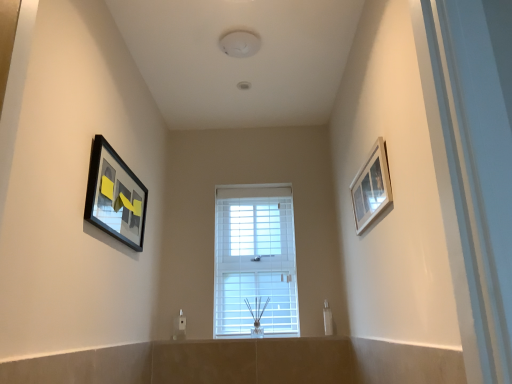
Question: From a real-world perspective, is white glossy picture frame at upper right, marked as the 1th picture frame in a right-to-left arrangement, beneath matte black picture frame at left, the second picture frame from the right?

Choices:
 (A) no
 (B) yes

Answer: (B)

Question: Can you confirm if white glossy picture frame at upper right, marked as the 1th picture frame in a right-to-left arrangement, is positioned to the right of matte black picture frame at left, the second picture frame from the right?

Choices:
 (A) yes
 (B) no

Answer: (A)

Question: Can you confirm if white glossy picture frame at upper right, marked as the 1th picture frame in a right-to-left arrangement, is smaller than matte black picture frame at left, the 1th picture frame viewed from the left?

Choices:
 (A) yes
 (B) no

Answer: (A)

Question: Can you confirm if white glossy picture frame at upper right, marked as the 1th picture frame in a right-to-left arrangement, is wider than matte black picture frame at left, the 1th picture frame viewed from the left?

Choices:
 (A) no
 (B) yes

Answer: (A)

Question: Is the surface of white glossy picture frame at upper right, the second picture frame when ordered from left to right, in direct contact with matte black picture frame at left, the second picture frame from the right?

Choices:
 (A) yes
 (B) no

Answer: (B)

Question: Is matte black picture frame at left, the 1th picture frame viewed from the left, situated inside white glossy picture frame at upper right, marked as the 1th picture frame in a right-to-left arrangement, or outside?

Choices:
 (A) outside
 (B) inside

Answer: (A)

Question: From their relative heights in the image, would you say matte black picture frame at left, the second picture frame from the right, is taller or shorter than white glossy picture frame at upper right, marked as the 1th picture frame in a right-to-left arrangement?

Choices:
 (A) short
 (B) tall

Answer: (B)

Question: Based on their positions, is matte black picture frame at left, the 1th picture frame viewed from the left, located to the left or right of white glossy picture frame at upper right, marked as the 1th picture frame in a right-to-left arrangement?

Choices:
 (A) right
 (B) left

Answer: (B)

Question: Does point (103, 158) appear closer or farther from the camera than point (391, 193)?

Choices:
 (A) closer
 (B) farther

Answer: (B)

Question: Is white matte window at center taller or shorter than white glossy picture frame at upper right, marked as the 1th picture frame in a right-to-left arrangement?

Choices:
 (A) short
 (B) tall

Answer: (B)

Question: From a real-world perspective, relative to white glossy picture frame at upper right, marked as the 1th picture frame in a right-to-left arrangement, is white matte window at center vertically above or below?

Choices:
 (A) above
 (B) below

Answer: (B)

Question: Is white matte window at center bigger or smaller than white glossy picture frame at upper right, the second picture frame when ordered from left to right?

Choices:
 (A) big
 (B) small

Answer: (A)

Question: Is point (258, 288) positioned closer to the camera than point (362, 183)?

Choices:
 (A) farther
 (B) closer

Answer: (A)

Question: Choose the correct answer: Is white glossy picture frame at upper right, the second picture frame when ordered from left to right, inside white matte window at center or outside it?

Choices:
 (A) outside
 (B) inside

Answer: (A)

Question: Is white glossy picture frame at upper right, marked as the 1th picture frame in a right-to-left arrangement, in front of or behind white matte window at center in the image?

Choices:
 (A) behind
 (B) front

Answer: (B)